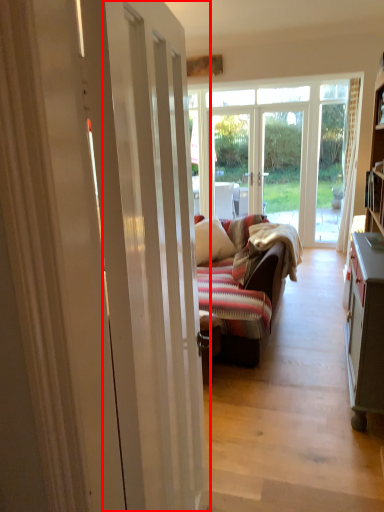
Question: Where is door (annotated by the red box) located in relation to pillow in the image?

Choices:
 (A) right
 (B) left

Answer: (B)